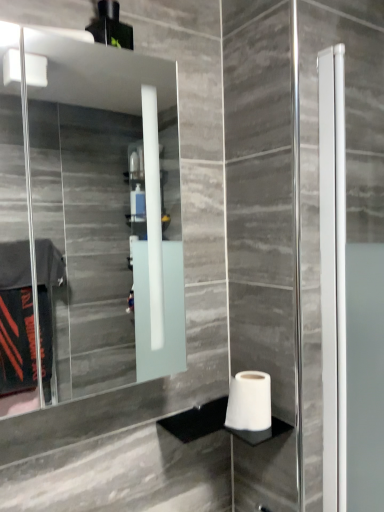
Question: Is point (104, 142) positioned closer to the camera than point (238, 431)?

Choices:
 (A) farther
 (B) closer

Answer: (A)

Question: From the image's perspective, is clear glass mirror at upper left above or below white matte toilet paper at lower right?

Choices:
 (A) above
 (B) below

Answer: (A)

Question: Is clear glass mirror at upper left inside or outside of white matte toilet paper at lower right?

Choices:
 (A) inside
 (B) outside

Answer: (B)

Question: Considering the positions of white matte toilet paper at lower right and clear glass mirror at upper left in the image, is white matte toilet paper at lower right wider or thinner than clear glass mirror at upper left?

Choices:
 (A) wide
 (B) thin

Answer: (B)

Question: Visually, is white matte toilet paper at lower right positioned to the left or to the right of clear glass mirror at upper left?

Choices:
 (A) left
 (B) right

Answer: (B)

Question: Is point (249, 413) closer or farther from the camera than point (79, 354)?

Choices:
 (A) closer
 (B) farther

Answer: (A)

Question: Choose the correct answer: Is white matte toilet paper at lower right inside clear glass mirror at upper left or outside it?

Choices:
 (A) inside
 (B) outside

Answer: (B)